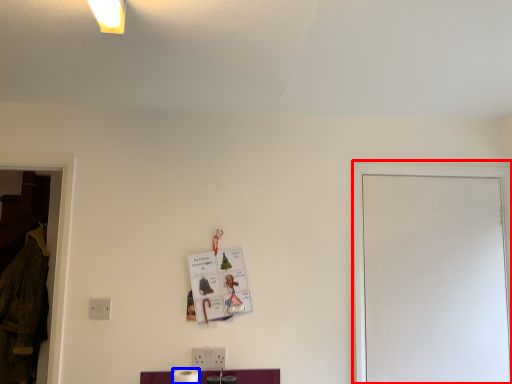
Question: Which object appears farthest to the camera in this image, glass door (highlighted by a red box) or toilet paper (highlighted by a blue box)?

Choices:
 (A) glass door
 (B) toilet paper

Answer: (A)